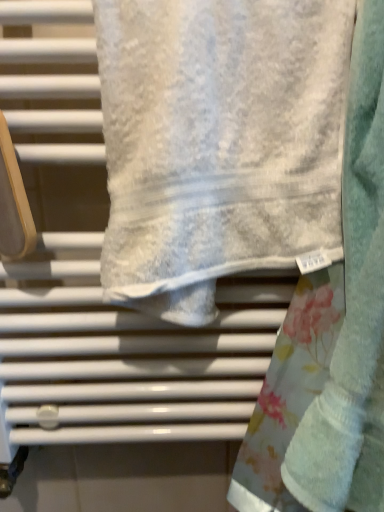
Looking at this image, in order to face white textured towel at center, placed as the 2th towel when sorted from right to left, should I rotate leftwards or rightwards?

A 4.919 degree turn to the right will do.

What do you see at coordinates (218, 143) in the screenshot? I see `white textured towel at center, the 1th towel when ordered from left to right` at bounding box center [218, 143].

The image size is (384, 512). What are the coordinates of `white textured towel at center, the 1th towel when ordered from left to right` in the screenshot? It's located at pos(218,143).

What do you see at coordinates (346, 324) in the screenshot? I see `fluffy white towel at center, which appears as the second towel when viewed from the left` at bounding box center [346, 324].

The image size is (384, 512). Find the location of `fluffy white towel at center, which appears as the second towel when viewed from the left`. fluffy white towel at center, which appears as the second towel when viewed from the left is located at coordinates (346, 324).

Find the location of a particular element. The width and height of the screenshot is (384, 512). white textured towel at center, the 1th towel when ordered from left to right is located at coordinates (218, 143).

Between white textured towel at center, the 1th towel when ordered from left to right, and fluffy white towel at center, which appears as the second towel when viewed from the left, which one appears on the right side from the viewer's perspective?

fluffy white towel at center, which appears as the second towel when viewed from the left.

Which is behind, white textured towel at center, the 1th towel when ordered from left to right, or fluffy white towel at center, which appears as the second towel when viewed from the left?

Positioned behind is white textured towel at center, the 1th towel when ordered from left to right.

Which is nearer, (186, 87) or (362, 109)?

Clearly, point (186, 87) is closer to the camera than point (362, 109).

From the image's perspective, between white textured towel at center, placed as the 2th towel when sorted from right to left, and fluffy white towel at center, which appears as the second towel when viewed from the left, who is located below?

From the image's view, fluffy white towel at center, which appears as the second towel when viewed from the left, is below.

From a real-world perspective, is white textured towel at center, the 1th towel when ordered from left to right, over fluffy white towel at center, which appears as the second towel when viewed from the left?

Yes, from a real-world perspective, white textured towel at center, the 1th towel when ordered from left to right, is above fluffy white towel at center, which appears as the second towel when viewed from the left.

Based on the photo, between white textured towel at center, the 1th towel when ordered from left to right, and fluffy white towel at center, which appears as the second towel when viewed from the left, which one has smaller width?

Thinner between the two is white textured towel at center, the 1th towel when ordered from left to right.

Considering the relative sizes of white textured towel at center, the 1th towel when ordered from left to right, and fluffy white towel at center, which appears as the second towel when viewed from the left, in the image provided, is white textured towel at center, the 1th towel when ordered from left to right, shorter than fluffy white towel at center, which appears as the second towel when viewed from the left,?

→ Yes.

Between white textured towel at center, the 1th towel when ordered from left to right, and fluffy white towel at center, the 1th towel positioned from the right, which one has smaller size?

white textured towel at center, the 1th towel when ordered from left to right, is smaller.

Is white textured towel at center, the 1th towel when ordered from left to right, positioned beyond the bounds of fluffy white towel at center, which appears as the second towel when viewed from the left?

Yes, white textured towel at center, the 1th towel when ordered from left to right, is not within fluffy white towel at center, which appears as the second towel when viewed from the left.

Are white textured towel at center, placed as the 2th towel when sorted from right to left, and fluffy white towel at center, which appears as the second towel when viewed from the left, located far from each other?

No, there isn't a large distance between white textured towel at center, placed as the 2th towel when sorted from right to left, and fluffy white towel at center, which appears as the second towel when viewed from the left.

Is white textured towel at center, placed as the 2th towel when sorted from right to left, aimed at fluffy white towel at center, the 1th towel positioned from the right?

No, white textured towel at center, placed as the 2th towel when sorted from right to left, is not oriented towards fluffy white towel at center, the 1th towel positioned from the right.

How different are the orientations of white textured towel at center, placed as the 2th towel when sorted from right to left, and fluffy white towel at center, which appears as the second towel when viewed from the left, in degrees?

The angular difference between white textured towel at center, placed as the 2th towel when sorted from right to left, and fluffy white towel at center, which appears as the second towel when viewed from the left, is 0.00179 degrees.

How much distance is there between white textured towel at center, the 1th towel when ordered from left to right, and fluffy white towel at center, which appears as the second towel when viewed from the left?

A distance of 5.25 inches exists between white textured towel at center, the 1th towel when ordered from left to right, and fluffy white towel at center, which appears as the second towel when viewed from the left.

At what (x,y) coordinates should I click in order to perform the action: click on towel below the white textured towel at center, the 1th towel when ordered from left to right (from the image's perspective). Please return your answer as a coordinate pair (x, y). Looking at the image, I should click on tap(346, 324).

Is fluffy white towel at center, which appears as the second towel when viewed from the left, at the left side of white textured towel at center, the 1th towel when ordered from left to right?

In fact, fluffy white towel at center, which appears as the second towel when viewed from the left, is to the right of white textured towel at center, the 1th towel when ordered from left to right.

Which object is more forward, fluffy white towel at center, which appears as the second towel when viewed from the left, or white textured towel at center, placed as the 2th towel when sorted from right to left?

fluffy white towel at center, which appears as the second towel when viewed from the left, is in front.

Considering the positions of points (378, 432) and (237, 42), is point (378, 432) farther from camera compared to point (237, 42)?

Yes, point (378, 432) is behind point (237, 42).

From the image's perspective, is fluffy white towel at center, which appears as the second towel when viewed from the left, under white textured towel at center, placed as the 2th towel when sorted from right to left?

Yes, from the image's perspective, fluffy white towel at center, which appears as the second towel when viewed from the left, is below white textured towel at center, placed as the 2th towel when sorted from right to left.

From a real-world perspective, is fluffy white towel at center, the 1th towel positioned from the right, above or below white textured towel at center, the 1th towel when ordered from left to right?

In terms of real-world spatial position, fluffy white towel at center, the 1th towel positioned from the right, is below white textured towel at center, the 1th towel when ordered from left to right.

Which object is wider, fluffy white towel at center, which appears as the second towel when viewed from the left, or white textured towel at center, placed as the 2th towel when sorted from right to left?

fluffy white towel at center, which appears as the second towel when viewed from the left.

Can you confirm if fluffy white towel at center, the 1th towel positioned from the right, is shorter than white textured towel at center, the 1th towel when ordered from left to right?

Incorrect, the height of fluffy white towel at center, the 1th towel positioned from the right, does not fall short of that of white textured towel at center, the 1th towel when ordered from left to right.

In terms of size, does fluffy white towel at center, the 1th towel positioned from the right, appear bigger or smaller than white textured towel at center, the 1th towel when ordered from left to right?

Clearly, fluffy white towel at center, the 1th towel positioned from the right, is larger in size than white textured towel at center, the 1th towel when ordered from left to right.

Which is correct: fluffy white towel at center, the 1th towel positioned from the right, is inside white textured towel at center, placed as the 2th towel when sorted from right to left, or outside of it?

fluffy white towel at center, the 1th towel positioned from the right, is outside white textured towel at center, placed as the 2th towel when sorted from right to left.

Is fluffy white towel at center, which appears as the second towel when viewed from the left, next to white textured towel at center, placed as the 2th towel when sorted from right to left?

No.

Is fluffy white towel at center, the 1th towel positioned from the right, facing towards white textured towel at center, the 1th towel when ordered from left to right?

No, fluffy white towel at center, the 1th towel positioned from the right, is not facing towards white textured towel at center, the 1th towel when ordered from left to right.

Could you measure the distance between fluffy white towel at center, the 1th towel positioned from the right, and white textured towel at center, the 1th towel when ordered from left to right?

A distance of 5.25 inches exists between fluffy white towel at center, the 1th towel positioned from the right, and white textured towel at center, the 1th towel when ordered from left to right.

Locate an element on the screen. The height and width of the screenshot is (512, 384). towel to the left of fluffy white towel at center, which appears as the second towel when viewed from the left is located at coordinates (218, 143).

Identify the location of towel on the left of the fluffy white towel at center, which appears as the second towel when viewed from the left. (218, 143).

The height and width of the screenshot is (512, 384). Find the location of `towel above the fluffy white towel at center, which appears as the second towel when viewed from the left (from a real-world perspective)`. towel above the fluffy white towel at center, which appears as the second towel when viewed from the left (from a real-world perspective) is located at coordinates (218, 143).